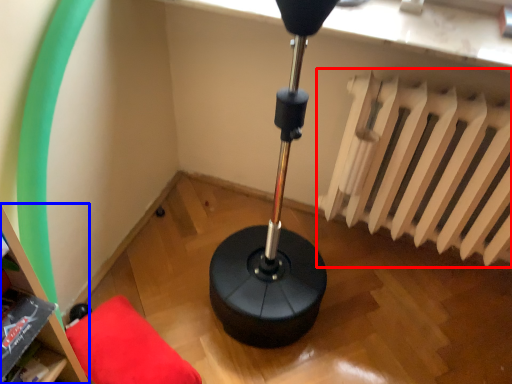
Question: Which object is closer to the camera taking this photo, radiator (highlighted by a red box) or bookshelf (highlighted by a blue box)?

Choices:
 (A) radiator
 (B) bookshelf

Answer: (B)